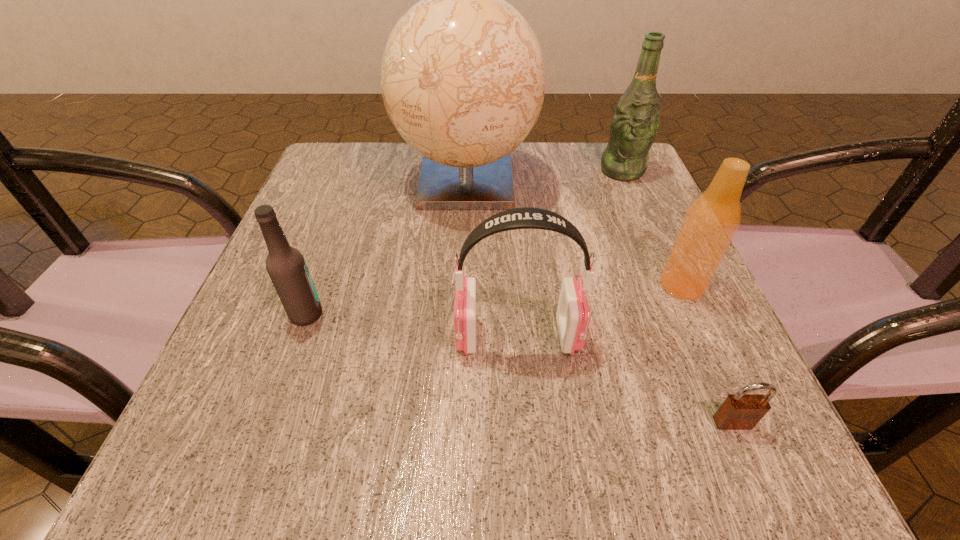
In order to click on free space at the near right corner in this screenshot , I will do `click(691, 460)`.

The height and width of the screenshot is (540, 960). What are the coordinates of `empty location between the earphone and the padlock` in the screenshot? It's located at (625, 379).

In order to click on vacant area that lies between the third farthest object and the earphone in this screenshot , I will do `click(600, 310)`.

This screenshot has width=960, height=540. In order to click on free area in between the earphone and the third farthest object in this screenshot , I will do `click(600, 310)`.

The width and height of the screenshot is (960, 540). What are the coordinates of `free space between the second farthest beer bottle and the earphone` in the screenshot? It's located at (600, 310).

Where is `vacant space that is in between the leftmost beer bottle and the earphone`? Image resolution: width=960 pixels, height=540 pixels. vacant space that is in between the leftmost beer bottle and the earphone is located at coordinates (412, 325).

The width and height of the screenshot is (960, 540). What are the coordinates of `unoccupied position between the nearest beer bottle and the earphone` in the screenshot? It's located at (412, 325).

Locate an element on the screen. Image resolution: width=960 pixels, height=540 pixels. unoccupied area between the second farthest beer bottle and the earphone is located at coordinates (600, 310).

Identify the location of empty space that is in between the tallest beer bottle and the second nearest beer bottle. 652,228.

The image size is (960, 540). I want to click on free space between the shortest object and the second nearest beer bottle, so click(708, 354).